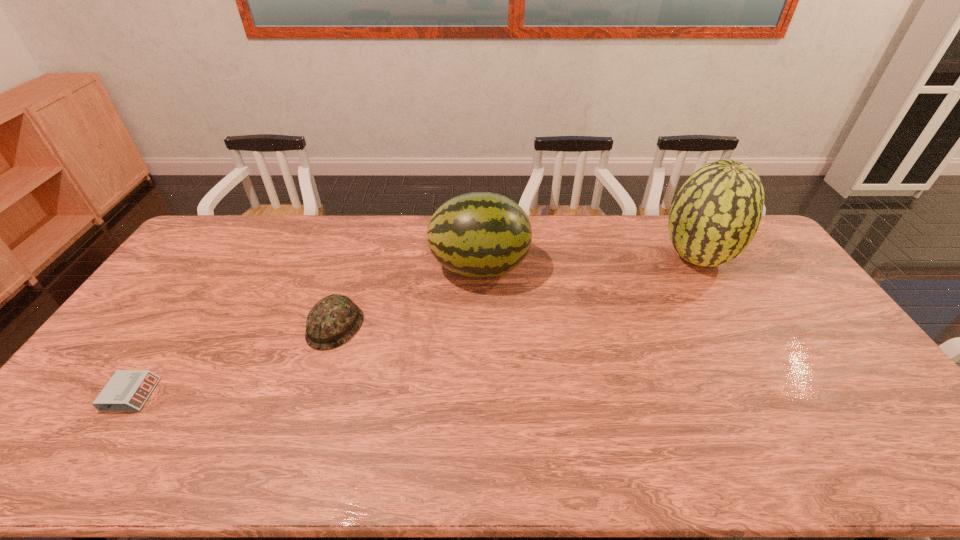
At what (x,y) coordinates should I click in order to perform the action: click on the rightmost object. Please return your answer as a coordinate pair (x, y). The image size is (960, 540). Looking at the image, I should click on (716, 213).

In order to click on the tallest object in this screenshot , I will do `click(716, 213)`.

Find the location of a particular element. the third shortest object is located at coordinates (480, 234).

This screenshot has height=540, width=960. Find the location of `the second object from right to left`. the second object from right to left is located at coordinates (480, 234).

The image size is (960, 540). I want to click on the second nearest object, so click(x=332, y=321).

Find the location of `the second shortest object`. the second shortest object is located at coordinates (332, 321).

Where is `the shortest object`? This screenshot has width=960, height=540. the shortest object is located at coordinates (127, 390).

Find the location of `the nearest object`. the nearest object is located at coordinates (127, 390).

This screenshot has width=960, height=540. What are the coordinates of `vacant space situated on the left of the rightmost object` in the screenshot? It's located at (571, 258).

Find the location of `free space located 0.100m at the stem end of the left watermelon`. free space located 0.100m at the stem end of the left watermelon is located at coordinates (558, 267).